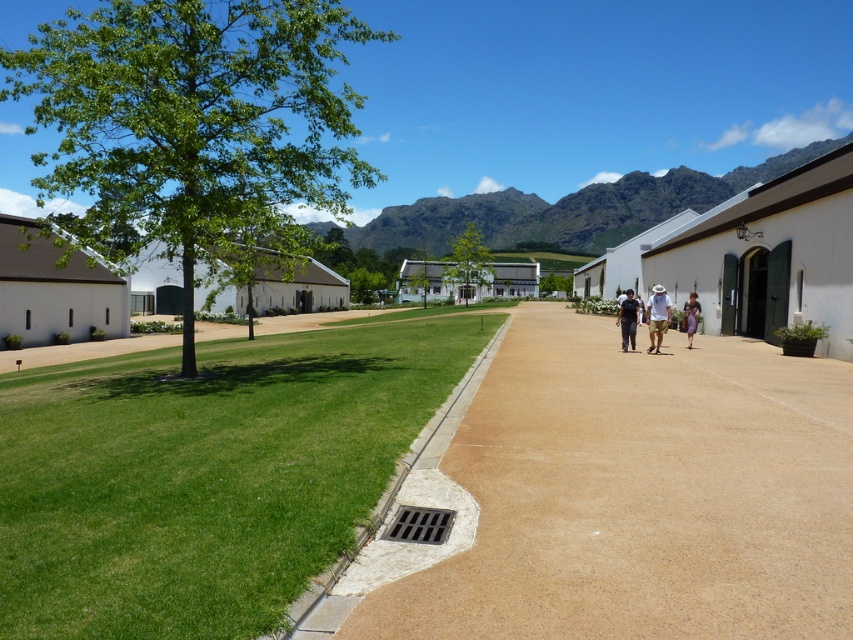
You are a gardener wearing a dark blue shirt at center and need to walk along the brown concrete path at center. Can you walk comfortably without stepping off the path?

The brown concrete path at center might be wider than dark blue shirt at center, so it is possible that the path is wide enough for you to walk comfortably without stepping off.